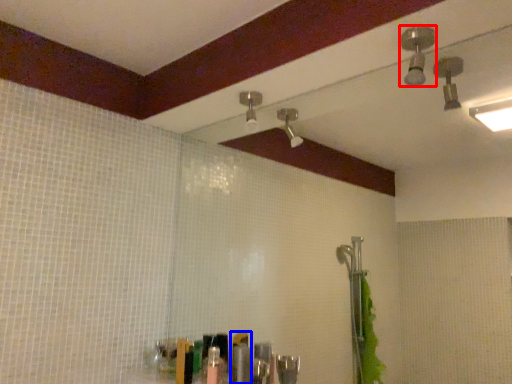
Question: Which object is closer to the camera taking this photo, shower (highlighted by a red box) or toiletry (highlighted by a blue box)?

Choices:
 (A) shower
 (B) toiletry

Answer: (A)